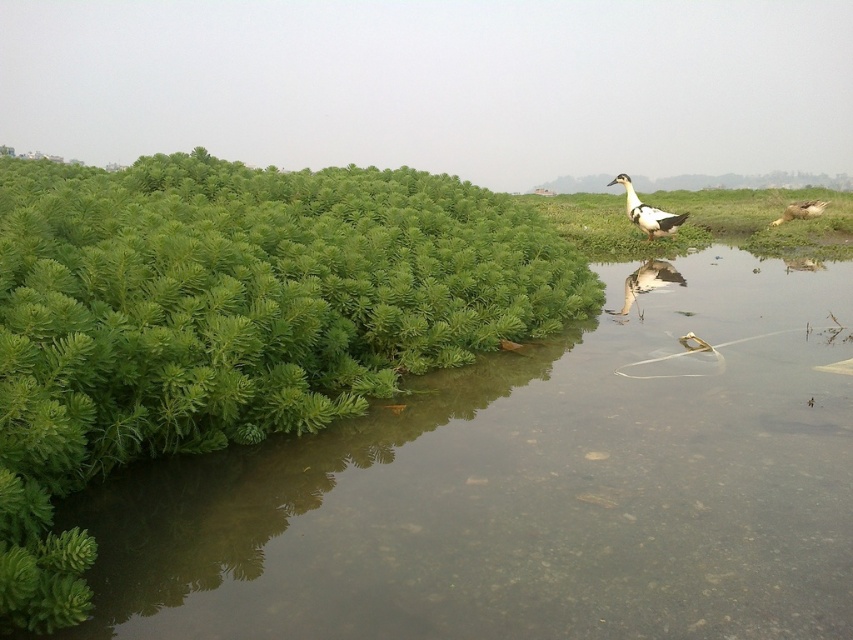
Looking at this image, you are a birdwatcher observing the scene. You notice two points marked in the image. The first point is at coordinate point(x=235, y=547) and the second is at point(x=659, y=268). Which point is closer to the bird?

Point(x=235, y=547) is in front of point(x=659, y=268), so the first point is closer to the bird.